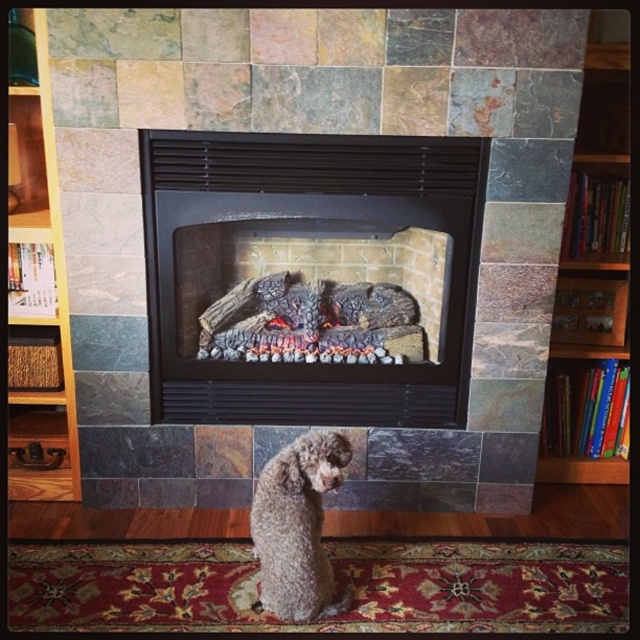
The width and height of the screenshot is (640, 640). What do you see at coordinates (588, 220) in the screenshot?
I see `brown wooden bookshelf at right` at bounding box center [588, 220].

Does brown wooden bookshelf at right appear over gray curly fur dog at center?

Yes.

Which is behind, point (600, 260) or point (275, 529)?

Positioned behind is point (600, 260).

Image resolution: width=640 pixels, height=640 pixels. In order to click on brown wooden bookshelf at right in this screenshot , I will do `click(588, 220)`.

Can you confirm if black matte fireplace at center is taller than gray curly fur dog at center?

Yes, black matte fireplace at center is taller than gray curly fur dog at center.

Between point (305, 400) and point (304, 461), which one is positioned behind?

Point (305, 400)

Image resolution: width=640 pixels, height=640 pixels. Find the location of `black matte fireplace at center`. black matte fireplace at center is located at coordinates (310, 276).

Identify the location of black matte fireplace at center. This screenshot has width=640, height=640. (310, 276).

Is wooden bookshelf at left above gray curly fur dog at center?

Yes.

Is wooden bookshelf at left closer to the viewer compared to gray curly fur dog at center?

No, it is behind gray curly fur dog at center.

Consider the image. Measure the distance between point (36,456) and camera.

Point (36,456) and camera are 7.61 feet apart from each other.

Locate an element on the screen. The width and height of the screenshot is (640, 640). wooden bookshelf at left is located at coordinates (36, 296).